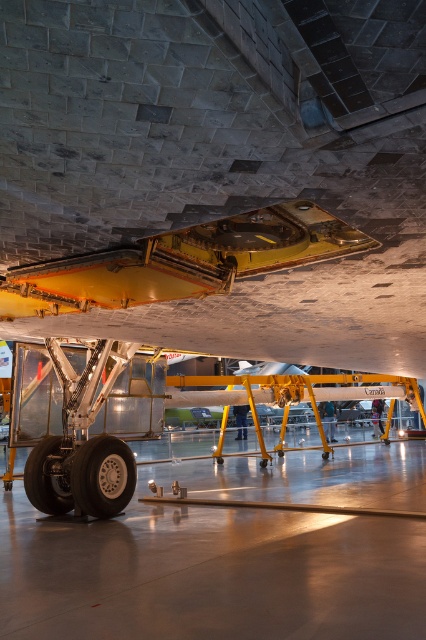
You are a maintenance worker in the hangar and need to move a heavy equipment cart from the concrete tarmac at center to the metallic yellow wing at center. Which direction should you move the cart to reach the wing?

The concrete tarmac at center is to the left of the metallic yellow wing at center, so you should move the cart to the right to reach the wing.

You are standing in the aircraft hangar and see two points on the wing. The first point is at coordinate [218,483] and the second is at [57,509]. Which point is closer to you?

Point [57,509] is closer to you because it is nearer to the camera than point [218,483].

What is the exact 2D coordinate of the concrete tarmac at center?

The concrete tarmac at center is located at the 2D coordinate point of (229, 556).